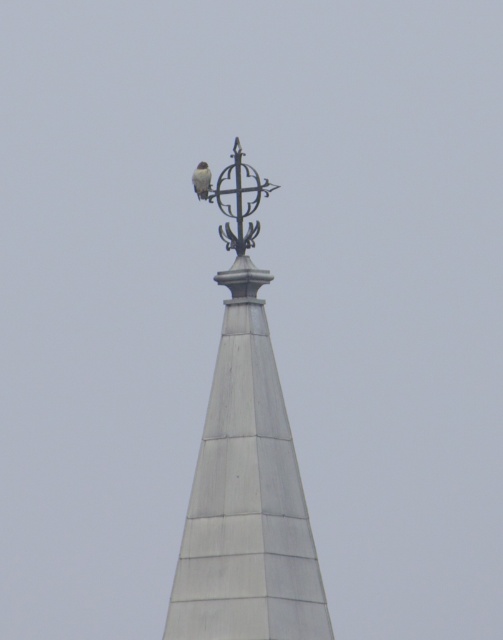
Between point (250, 202) and point (210, 173), which one is positioned in front?

Point (250, 202) is in front.

Find the location of a particular element. This screenshot has width=503, height=640. white matte spire at upper center is located at coordinates (245, 470).

Identify the location of white matte spire at upper center. The image size is (503, 640). (245, 470).

The image size is (503, 640). What are the coordinates of `white matte spire at upper center` in the screenshot? It's located at (245, 470).